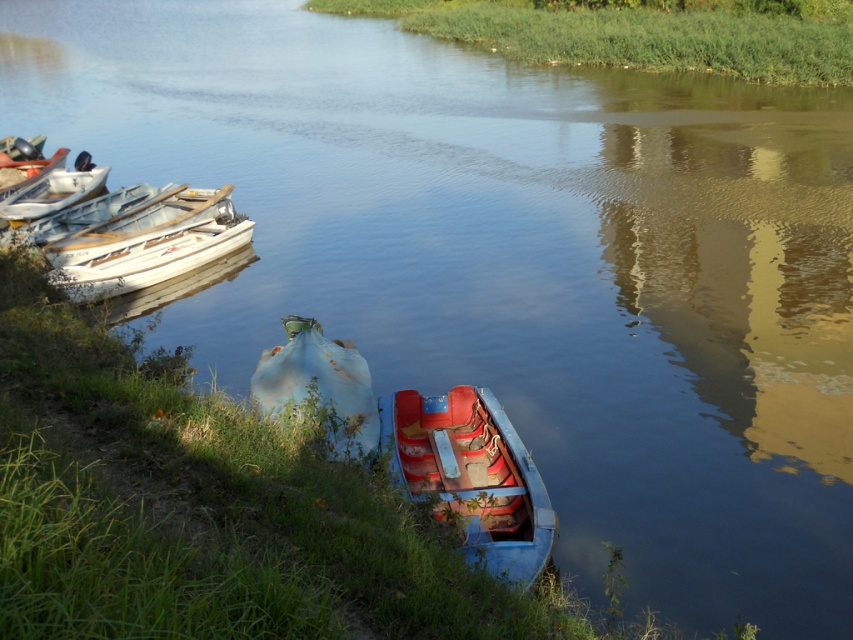
Question: Which object is farther from the camera taking this photo?

Choices:
 (A) white plastic boats at left
 (B) blue faded fabric boat at center

Answer: (A)

Question: From the image, what is the correct spatial relationship of rusty blue boat at center in relation to white plastic boats at left?

Choices:
 (A) left
 (B) right

Answer: (B)

Question: From the image, what is the correct spatial relationship of rusty blue boat at center in relation to white plastic boats at left?

Choices:
 (A) right
 (B) left

Answer: (A)

Question: Which object is positioned closest to the blue faded fabric boat at center?

Choices:
 (A) white plastic boats at left
 (B) white matte boat at left
 (C) rusty blue boat at center

Answer: (C)

Question: Among these points, which one is nearest to the camera?

Choices:
 (A) tap(467, 508)
 (B) tap(59, 288)
 (C) tap(312, 317)
 (D) tap(96, 193)

Answer: (A)

Question: Where is rusty blue boat at center located in relation to white plastic boats at left in the image?

Choices:
 (A) above
 (B) below

Answer: (B)